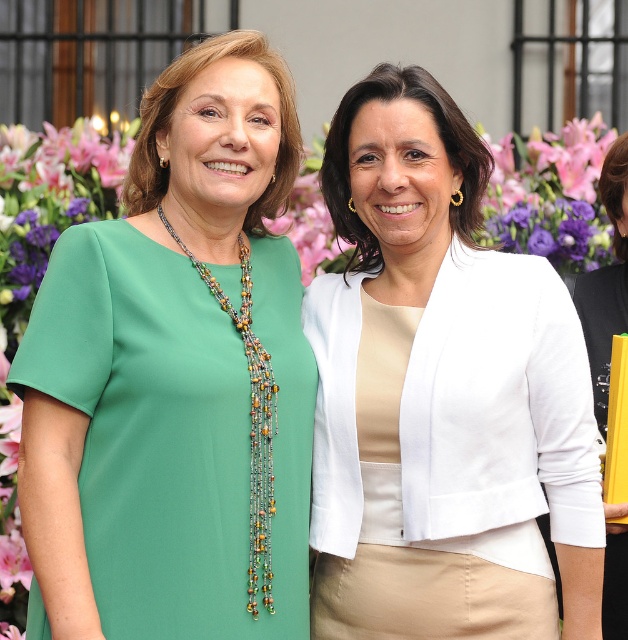
Question: Is green satin dress at left bigger than multicolored beaded necklace at center?

Choices:
 (A) yes
 (B) no

Answer: (A)

Question: Can you confirm if white fabric dress at center is bigger than multicolored beaded necklace at center?

Choices:
 (A) yes
 (B) no

Answer: (A)

Question: Can you confirm if white matte blazer at center is positioned to the right of multicolored beaded necklace at center?

Choices:
 (A) no
 (B) yes

Answer: (B)

Question: Estimate the real-world distances between objects in this image. Which object is farther from the green satin dress at left?

Choices:
 (A) white fabric dress at center
 (B) white matte blazer at center

Answer: (A)

Question: Which point appears closest to the camera in this image?

Choices:
 (A) (612, 564)
 (B) (414, 358)
 (C) (220, 550)

Answer: (C)

Question: Estimate the real-world distances between objects in this image. Which object is farther from the multicolored beaded necklace at center?

Choices:
 (A) white matte blazer at center
 (B) green satin dress at left
 (C) white fabric dress at center

Answer: (C)